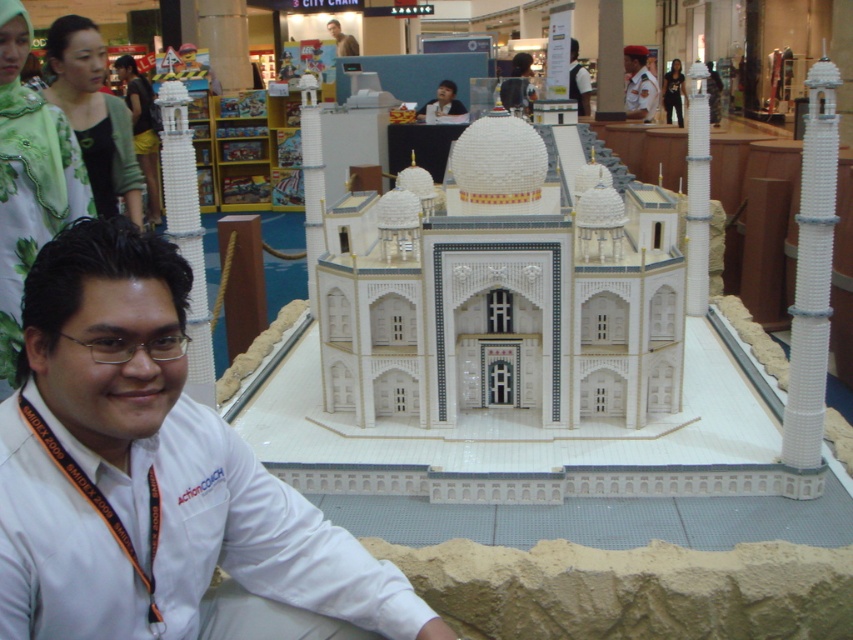
Based on the photo, is white matte shirt at center above light brown hair at center?

No.

Does point (148, 563) come closer to viewer compared to point (338, 36)?

Yes, it is in front of point (338, 36).

This screenshot has height=640, width=853. Find the location of `white matte shirt at center`. white matte shirt at center is located at coordinates (149, 470).

Between white matte shirt at center and white uniform at center, which one is positioned lower?

white matte shirt at center is below.

Is point (173, 509) in front of point (635, 113)?

Yes.

Who is more forward, (286, 570) or (653, 104)?

Point (286, 570)

This screenshot has width=853, height=640. I want to click on white matte shirt at center, so (x=149, y=470).

Is matte green dress at upper left shorter than matte white face at upper center?

In fact, matte green dress at upper left may be taller than matte white face at upper center.

Does matte green dress at upper left have a smaller size compared to matte white face at upper center?

No.

Which is in front, point (143, 145) or point (444, 90)?

Point (143, 145) is in front.

Identify the location of matte green dress at upper left. (142, 129).